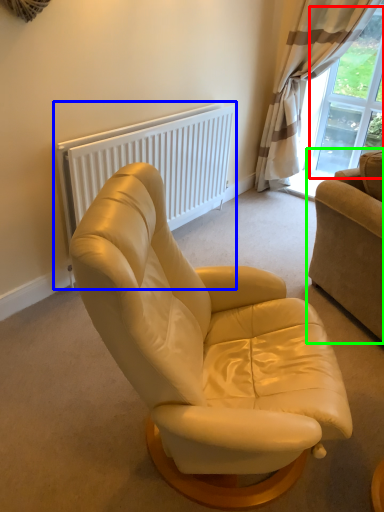
Question: Based on their relative distances, which object is farther from window screen (highlighted by a red box)? Choose from radiator (highlighted by a blue box) and studio couch (highlighted by a green box).

Choices:
 (A) radiator
 (B) studio couch

Answer: (B)